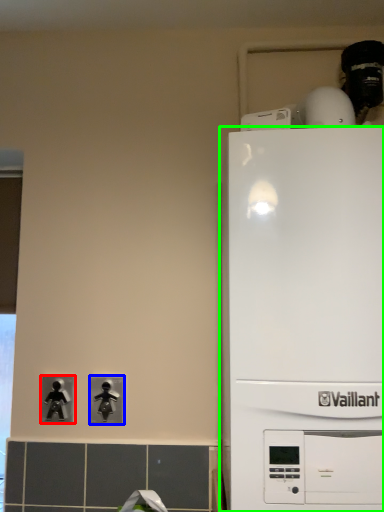
Question: Considering the real-world distances, which object is closest to light switch (highlighted by a red box)? light switch (highlighted by a blue box) or home appliance (highlighted by a green box).

Choices:
 (A) light switch
 (B) home appliance

Answer: (A)